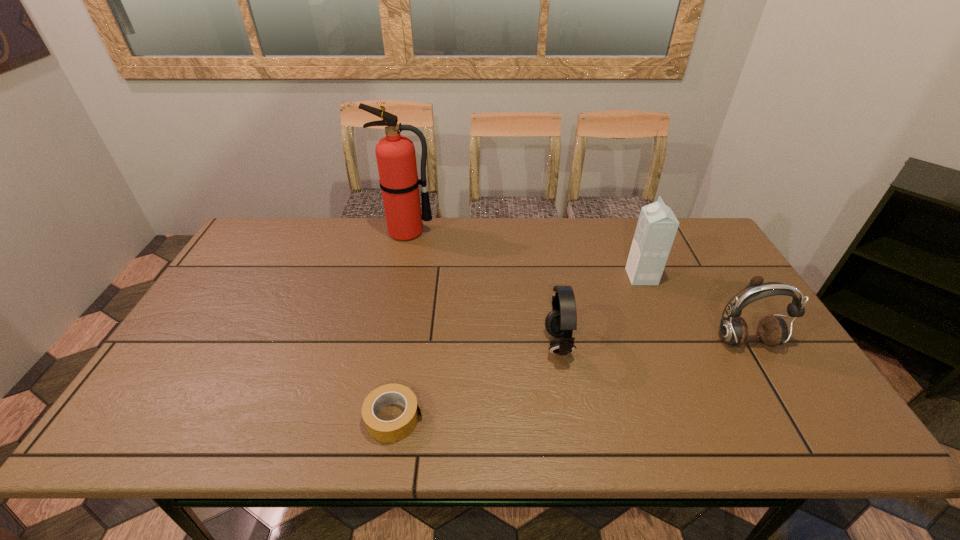
Identify which object is the fourth nearest to the taller earphone. Please provide its 2D coordinates. Your answer should be formatted as a tuple, i.e. [(x, y)], where the tuple contains the x and y coordinates of a point satisfying the conditions above.

[(395, 154)]

You are a GUI agent. You are given a task and a screenshot of the screen. Output one action in this format:
    pyautogui.click(x=<x>, y=<y>)
    Task: Click on the vacant point that satisfies the following two spatial constraints: 1. on the ear pads of the rightmost object; 2. at the edge of the shortest object
    Image resolution: width=960 pixels, height=540 pixels.
    Given the screenshot: What is the action you would take?
    790,418

Where is `free space in the image that satisfies the following two spatial constraints: 1. on the ear pads of the rightmost object; 2. at the edge of the shortest object`? Image resolution: width=960 pixels, height=540 pixels. free space in the image that satisfies the following two spatial constraints: 1. on the ear pads of the rightmost object; 2. at the edge of the shortest object is located at coordinates (790, 418).

Locate an element on the screen. This screenshot has width=960, height=540. free region that satisfies the following two spatial constraints: 1. on the ear pads of the taller earphone; 2. at the edge of the nearest object is located at coordinates (790, 418).